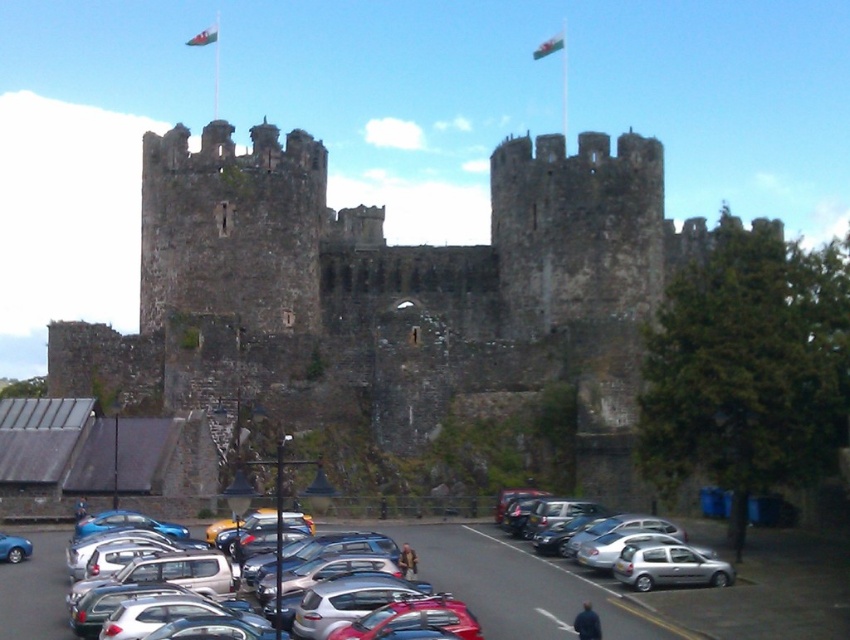
Does dark gray stone castle at center appear over silver metallic hatchback at lower right?

Correct, dark gray stone castle at center is located above silver metallic hatchback at lower right.

Describe the element at coordinates (389, 291) in the screenshot. The width and height of the screenshot is (850, 640). I see `dark gray stone castle at center` at that location.

What are the coordinates of `dark gray stone castle at center` in the screenshot? It's located at (389, 291).

Where is `dark gray stone castle at center`? Image resolution: width=850 pixels, height=640 pixels. dark gray stone castle at center is located at coordinates (389, 291).

Which is below, silver metallic car at lower center or green fabric flag at upper center?

Positioned lower is silver metallic car at lower center.

Based on the photo, is silver metallic car at lower center above green fabric flag at upper center?

No, silver metallic car at lower center is not above green fabric flag at upper center.

Does point (267, 593) come behind point (547, 42)?

No, (267, 593) is in front of (547, 42).

The image size is (850, 640). I want to click on silver metallic car at lower center, so click(x=316, y=556).

Between metallic cars at lower center and blue metallic car at lower left, which one appears on the right side from the viewer's perspective?

metallic cars at lower center is more to the right.

Does metallic cars at lower center have a lesser height compared to blue metallic car at lower left?

No, metallic cars at lower center is not shorter than blue metallic car at lower left.

Who is more forward, (491, 636) or (0, 554)?

Positioned in front is point (491, 636).

Find the location of a particular element. The height and width of the screenshot is (640, 850). metallic cars at lower center is located at coordinates (514, 582).